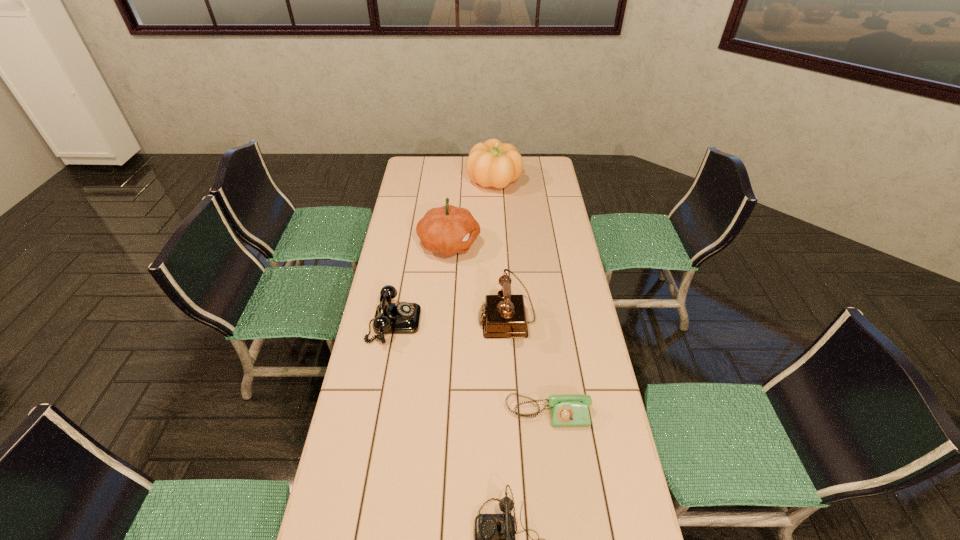
Identify the location of vacant space at the far right corner of the desktop. (554, 165).

Where is `vacant area between the nearer pumpkin and the farthest object`? vacant area between the nearer pumpkin and the farthest object is located at coordinates (471, 213).

Find the location of a particular element. The width and height of the screenshot is (960, 540). vacant region between the third shortest telephone and the nearer pumpkin is located at coordinates (421, 283).

Find the location of a particular element. vacant region between the third tallest object and the third shortest telephone is located at coordinates (450, 320).

This screenshot has height=540, width=960. What are the coordinates of `object that is the third closest to the farther pumpkin` in the screenshot? It's located at (390, 318).

Select which object appears as the fourth closest to the second tallest telephone. Please provide its 2D coordinates. Your answer should be formatted as a tuple, i.e. [(x, y)], where the tuple contains the x and y coordinates of a point satisfying the conditions above.

[(494, 534)]

Where is `the second closest telephone to the second farthest object`? The height and width of the screenshot is (540, 960). the second closest telephone to the second farthest object is located at coordinates (390, 318).

Locate an element on the screen. The image size is (960, 540). telephone that is the third closest to the second nearest telephone is located at coordinates (390, 318).